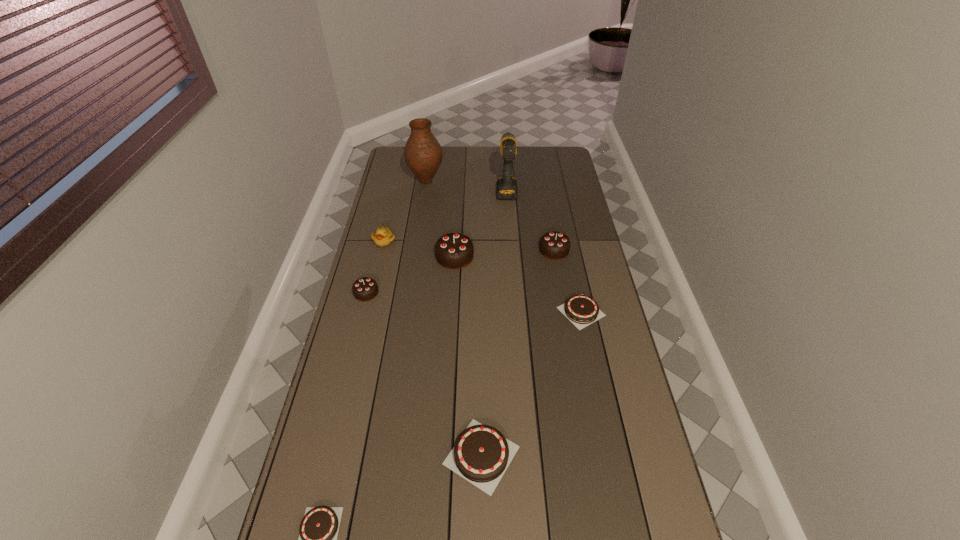
The width and height of the screenshot is (960, 540). I want to click on vase, so click(423, 155).

The width and height of the screenshot is (960, 540). Identify the location of drill. (507, 185).

Identify the location of the tallest chocolate cake. The height and width of the screenshot is (540, 960). (454, 250).

Where is `the biggest chocolate chocolate cake`? the biggest chocolate chocolate cake is located at coordinates (454, 250).

The height and width of the screenshot is (540, 960). I want to click on the second biggest chocolate chocolate cake, so click(554, 245).

Locate an element on the screen. the rightmost chocolate chocolate cake is located at coordinates (554, 245).

Image resolution: width=960 pixels, height=540 pixels. Find the location of `yellow duckling`. yellow duckling is located at coordinates (383, 237).

I want to click on the smallest chocolate chocolate cake, so click(x=364, y=289).

Locate an element on the screen. The height and width of the screenshot is (540, 960). the nearest chocolate chocolate cake is located at coordinates click(x=364, y=289).

Locate an element on the screen. The width and height of the screenshot is (960, 540). the second farthest brown chocolate cake is located at coordinates (x=481, y=455).